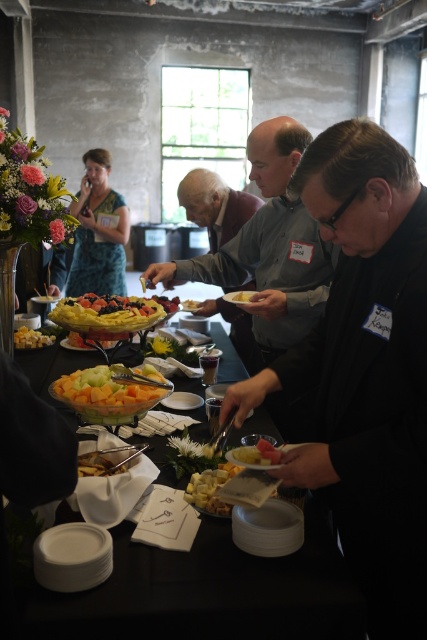
Can you confirm if yellow matte fruit at center is positioned to the left of black glossy grapes at center?

Incorrect, yellow matte fruit at center is not on the left side of black glossy grapes at center.

Does yellow matte fruit at center have a larger size compared to black glossy grapes at center?

Actually, yellow matte fruit at center might be smaller than black glossy grapes at center.

At what (x,y) coordinates should I click in order to perform the action: click on yellow matte fruit at center. Please return your answer as a coordinate pair (x, y). Looking at the image, I should click on (257, 452).

Identify the location of yellow matte fruit at center. (257, 452).

Which is in front, point (186, 179) or point (149, 314)?

Point (149, 314) is in front.

Is maroon sweater at center thinner than yellow cake at center?

Correct, maroon sweater at center's width is less than yellow cake at center's.

Describe the element at coordinates (215, 205) in the screenshot. The height and width of the screenshot is (640, 427). I see `maroon sweater at center` at that location.

Locate an element on the screen. maroon sweater at center is located at coordinates (215, 205).

Is point (108, 307) closer to viewer compared to point (107, 340)?

Yes, it is.

Is yellow cake at center thinner than translucent glass bowl at center?

Incorrect, yellow cake at center's width is not less than translucent glass bowl at center's.

Where is `yellow cake at center`? yellow cake at center is located at coordinates (105, 314).